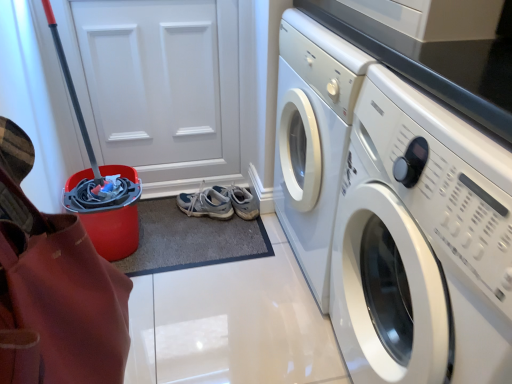
You are a GUI agent. You are given a task and a screenshot of the screen. Output one action in this format:
    pyautogui.click(x=<x>, y=<y>)
    Task: Click on the vacant location below light gray fabric running shoe at center (from a real-world perspective)
    The width and height of the screenshot is (512, 384).
    Given the screenshot: What is the action you would take?
    pyautogui.click(x=221, y=218)